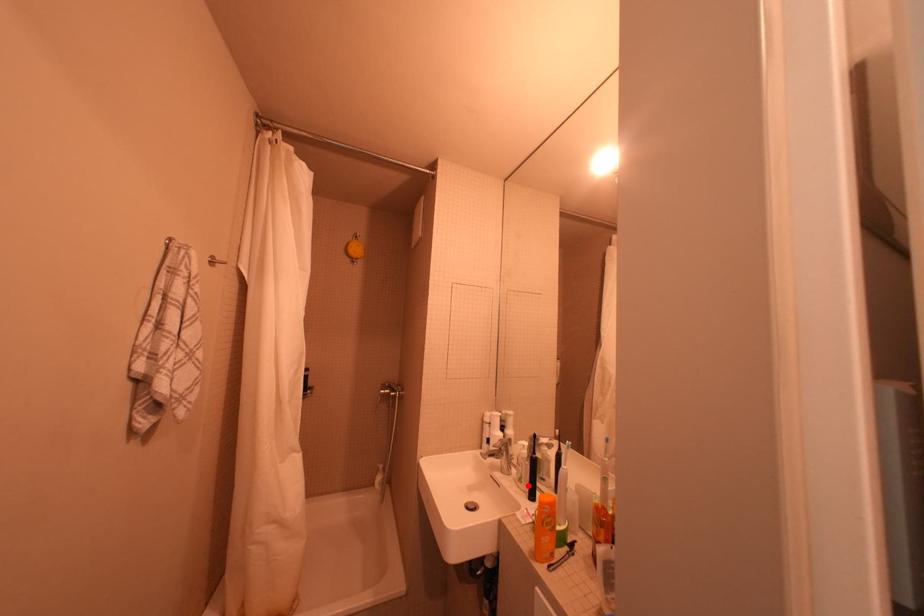
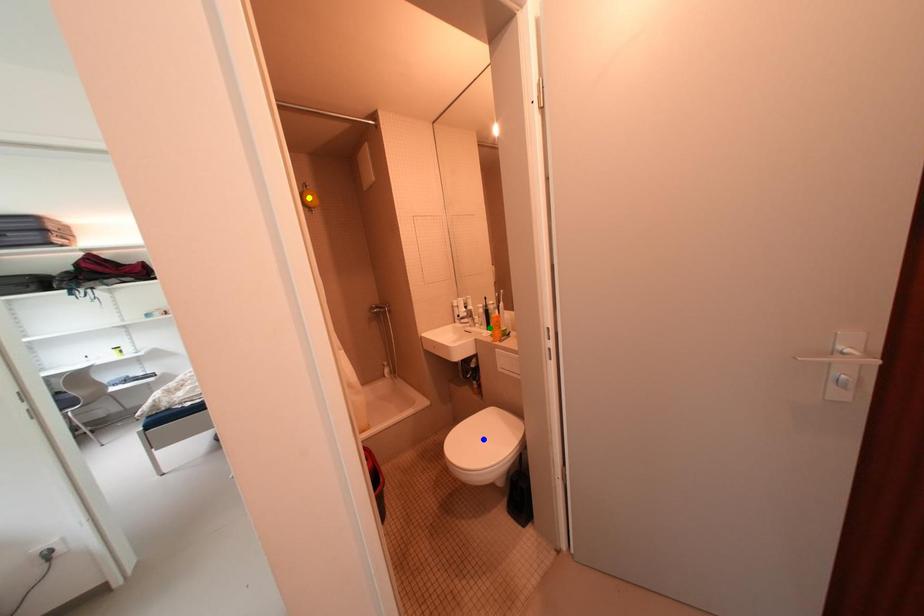
Question: I am providing you with two images of the same scene from different viewpoints. A red point is marked on the first image. You are given multiple points on the second image. Which mark in image 2 goes with the point in image 1?

Choices:
 (A) blue point
 (B) green point
 (C) yellow point

Answer: (B)